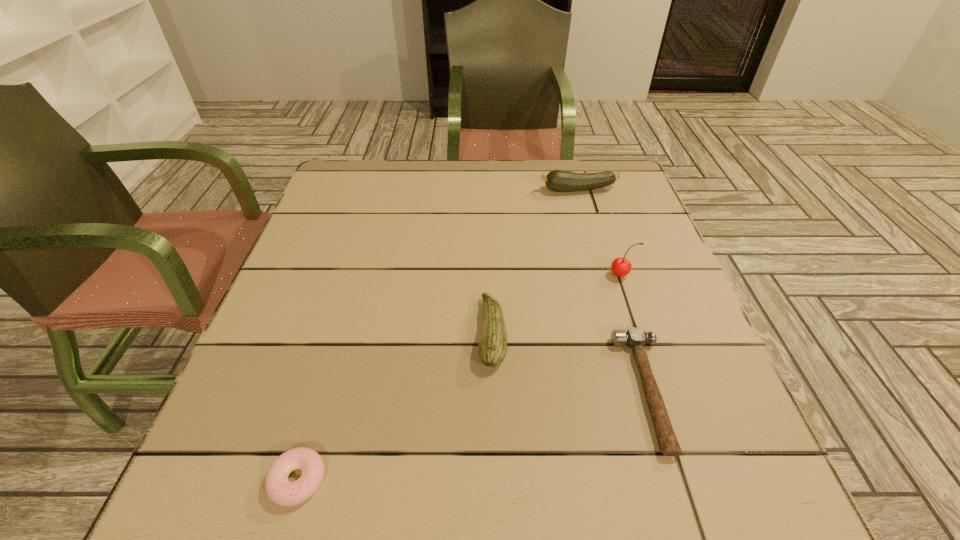
At what (x,y) coordinates should I click in order to perform the action: click on free space located at the blossom end of the right zucchini. Please return your answer as a coordinate pair (x, y). Looking at the image, I should click on click(401, 190).

You are a GUI agent. You are given a task and a screenshot of the screen. Output one action in this format:
    pyautogui.click(x=<x>, y=<y>)
    Task: Click on the free region located 0.080m at the blossom end of the right zucchini
    
    Given the screenshot: What is the action you would take?
    pyautogui.click(x=509, y=190)

Locate an element on the screen. vacant region located 0.160m at the stem end of the second object from left to right is located at coordinates (396, 333).

In order to click on blank area located at the stem end of the second object from left to right in this screenshot , I will do `click(386, 333)`.

Image resolution: width=960 pixels, height=540 pixels. I want to click on free space located at the stem end of the second object from left to right, so click(x=366, y=333).

Locate an element on the screen. This screenshot has width=960, height=540. vacant position located 0.240m on the striking face of the hammer is located at coordinates (487, 390).

Locate an element on the screen. Image resolution: width=960 pixels, height=540 pixels. blank space located on the striking face of the hammer is located at coordinates (447, 390).

This screenshot has height=540, width=960. In order to click on vacant region located 0.340m on the striking face of the hammer in this screenshot , I will do `click(430, 390)`.

Where is `vacant space situated on the left of the leftmost object`? The image size is (960, 540). vacant space situated on the left of the leftmost object is located at coordinates (190, 480).

At what (x,y) coordinates should I click in order to perform the action: click on object located in the far edge section of the desktop. Please return your answer as a coordinate pair (x, y). This screenshot has height=540, width=960. Looking at the image, I should click on (557, 180).